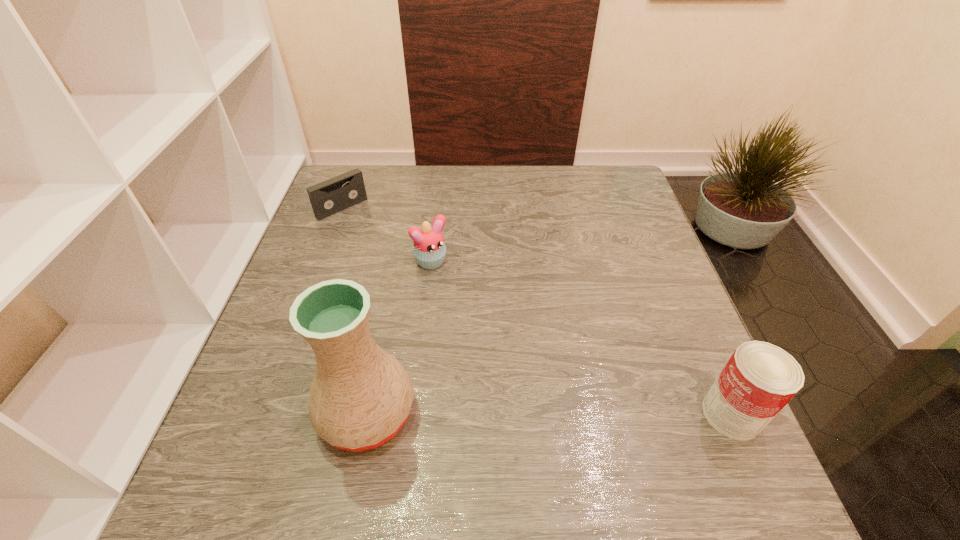
Where is `the tallest object`? The image size is (960, 540). the tallest object is located at coordinates (360, 397).

The height and width of the screenshot is (540, 960). In order to click on the second tallest object in this screenshot , I will do `click(759, 379)`.

Locate an element on the screen. the rightmost object is located at coordinates (759, 379).

The image size is (960, 540). Identify the location of cupcake. [429, 250].

Identify the location of the third tallest object. click(429, 250).

Identify the location of the leftmost object. (329, 197).

Where is `the shortest object`? The width and height of the screenshot is (960, 540). the shortest object is located at coordinates (329, 197).

Where is `vacant space located 0.140m on the back of the pottery`? The image size is (960, 540). vacant space located 0.140m on the back of the pottery is located at coordinates (386, 316).

Where is `vacant space situated 0.140m on the face of the cupcake`? This screenshot has height=540, width=960. vacant space situated 0.140m on the face of the cupcake is located at coordinates (478, 310).

Image resolution: width=960 pixels, height=540 pixels. Find the location of `free space located on the face of the cupcake`. free space located on the face of the cupcake is located at coordinates (533, 370).